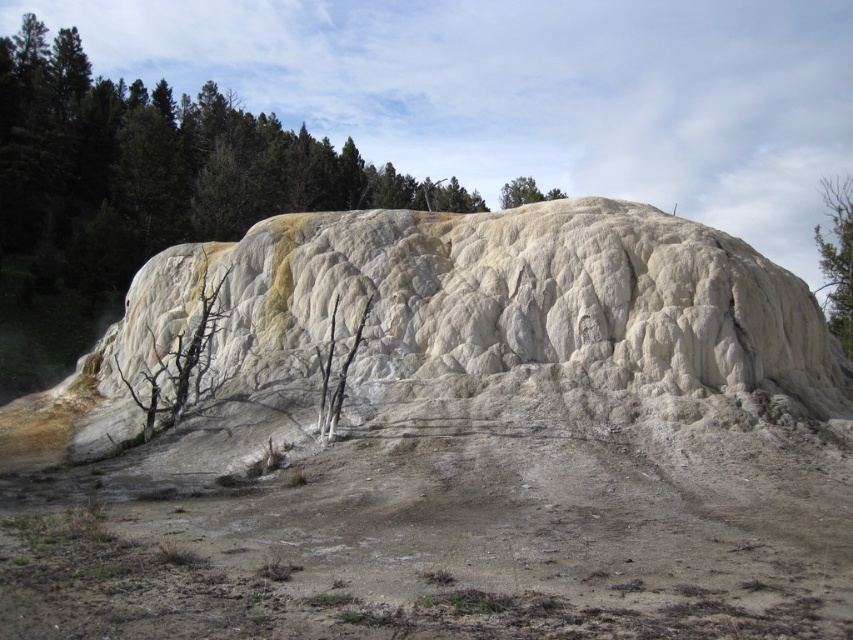
You are standing on the flat, barren area in front of the hot spring mound. You want to take a photo of the white textured rock at center and the green leafy tree at upper right. Which object should you focus on first if you want both to be in clear focus?

The white textured rock at center is shorter than the green leafy tree at upper right, so you should focus on the green leafy tree at upper right first to ensure both are in clear focus.

You are a hiker carrying a heavy backpack and need to cross from the dull brown dirt track at lower center to the hot spring mound. The distance between them is 16.59 feet. If your backpack allows you to walk 20 feet before needing a rest, can you make it without stopping?

The distance between the dull brown dirt track at lower center and the hot spring mound is 16.59 feet. Since your backpack allows you to walk 20 feet before needing a rest, you can make it without stopping as 16.59 feet is less than 20 feet.